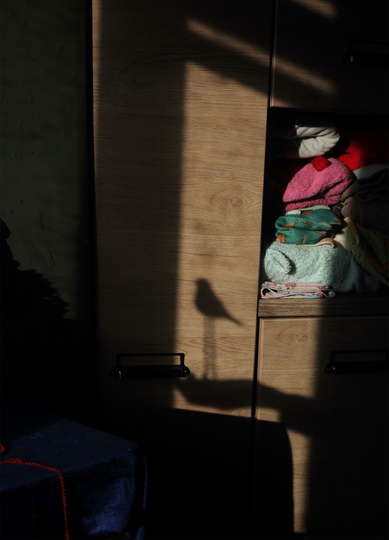
Locate an element on the screen. The image size is (389, 540). folded blanket is located at coordinates (324, 144).